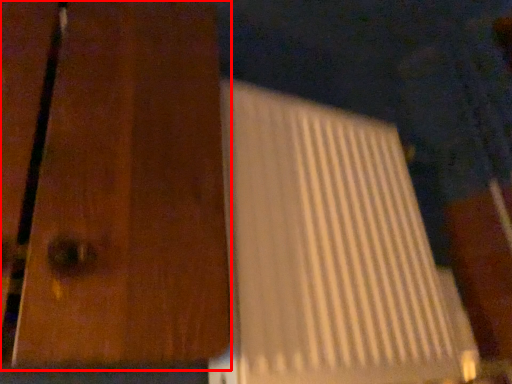
Question: From the image's perspective, what is the correct spatial relationship of door (annotated by the red box) in relation to wide?

Choices:
 (A) above
 (B) below

Answer: (A)